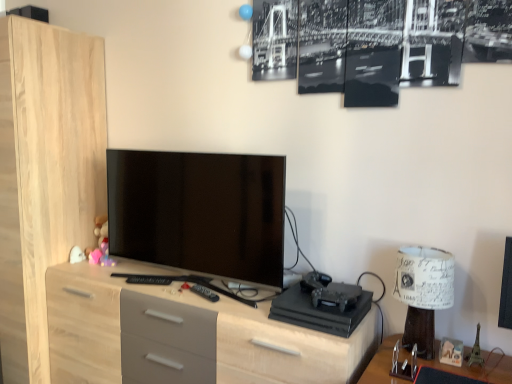
Question: From the image's perspective, is white paper lampshade at right on matte black tv at center?

Choices:
 (A) yes
 (B) no

Answer: (B)

Question: Is white paper lampshade at right facing away from matte black tv at center?

Choices:
 (A) no
 (B) yes

Answer: (A)

Question: Does white paper lampshade at right have a lesser height compared to matte black tv at center?

Choices:
 (A) no
 (B) yes

Answer: (B)

Question: Is white paper lampshade at right with matte black tv at center?

Choices:
 (A) no
 (B) yes

Answer: (A)

Question: Considering the relative sizes of white paper lampshade at right and matte black tv at center in the image provided, is white paper lampshade at right smaller than matte black tv at center?

Choices:
 (A) yes
 (B) no

Answer: (A)

Question: Is white paper lampshade at right far from matte black tv at center?

Choices:
 (A) no
 (B) yes

Answer: (A)

Question: Is matte black tv at center positioned with its back to white paper lampshade at right?

Choices:
 (A) no
 (B) yes

Answer: (A)

Question: From the image's perspective, is matte black tv at center on top of white paper lampshade at right?

Choices:
 (A) no
 (B) yes

Answer: (B)

Question: From the image's perspective, is matte black tv at center under white paper lampshade at right?

Choices:
 (A) yes
 (B) no

Answer: (B)

Question: Does matte black tv at center have a smaller size compared to white paper lampshade at right?

Choices:
 (A) no
 (B) yes

Answer: (A)

Question: Is matte black tv at center to the left of white paper lampshade at right from the viewer's perspective?

Choices:
 (A) no
 (B) yes

Answer: (B)

Question: Does matte black tv at center have a greater width compared to white paper lampshade at right?

Choices:
 (A) no
 (B) yes

Answer: (A)

Question: Considering the relative sizes of light wood/grey drawers at center and white paper lampshade at right in the image provided, is light wood/grey drawers at center wider than white paper lampshade at right?

Choices:
 (A) yes
 (B) no

Answer: (A)